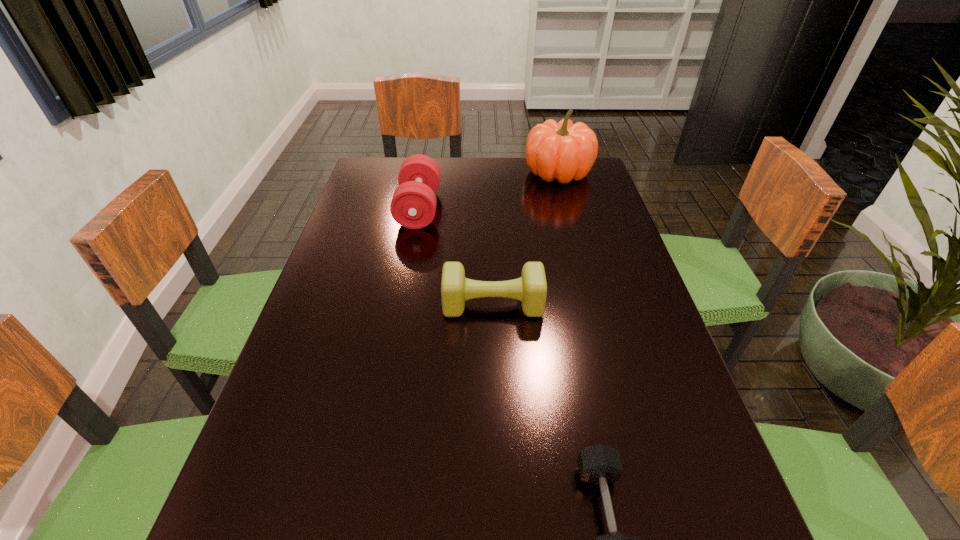
The width and height of the screenshot is (960, 540). I want to click on free spot between the tallest object and the third tallest object, so click(x=526, y=239).

The image size is (960, 540). Find the location of `empty location between the leftmost dumbbell and the pumpkin`. empty location between the leftmost dumbbell and the pumpkin is located at coordinates (489, 191).

At what (x,y) coordinates should I click in order to perform the action: click on vacant space that is in between the leftmost object and the second tallest dumbbell. Please return your answer as a coordinate pair (x, y). Image resolution: width=960 pixels, height=540 pixels. Looking at the image, I should click on [456, 256].

The height and width of the screenshot is (540, 960). Find the location of `empty space between the leftmost dumbbell and the tallest object`. empty space between the leftmost dumbbell and the tallest object is located at coordinates (489, 191).

This screenshot has height=540, width=960. I want to click on object that is the nearest to the rightmost dumbbell, so click(x=531, y=288).

Identify which object is the nearest to the second tallest object. Please provide its 2D coordinates. Your answer should be formatted as a tuple, i.e. [(x, y)], where the tuple contains the x and y coordinates of a point satisfying the conditions above.

[(531, 288)]

The image size is (960, 540). Find the location of `dumbbell that is the second closest to the pumpkin`. dumbbell that is the second closest to the pumpkin is located at coordinates (531, 288).

Choose which dumbbell is the second nearest neighbor to the rightmost dumbbell. Please provide its 2D coordinates. Your answer should be formatted as a tuple, i.e. [(x, y)], where the tuple contains the x and y coordinates of a point satisfying the conditions above.

[(413, 205)]